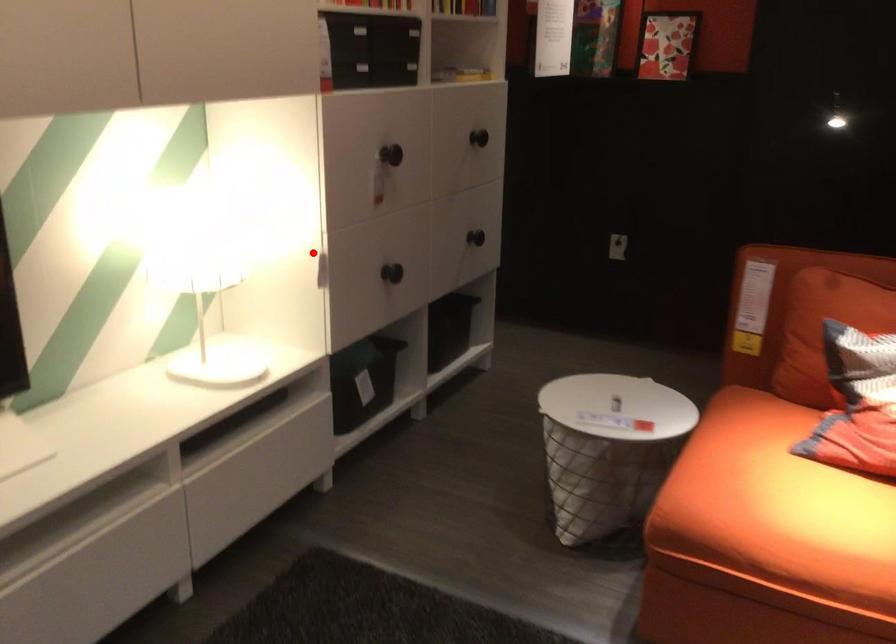
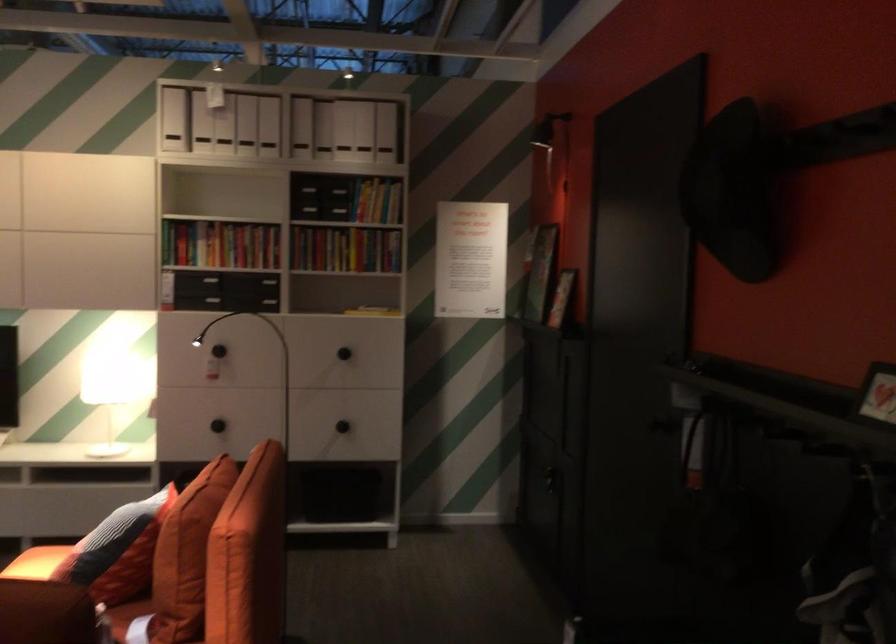
Question: I am providing you with two images of the same scene from different viewpoints. A red point is shown in image1. For the corresponding object point in image2, is it positioned nearer or farther from the camera?

Choices:
 (A) Nearer
 (B) Farther

Answer: (B)